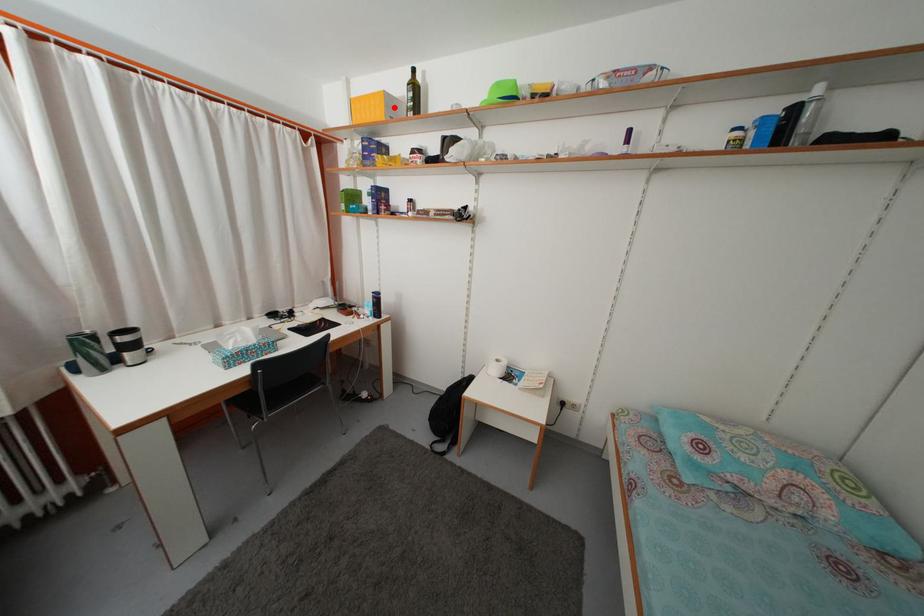
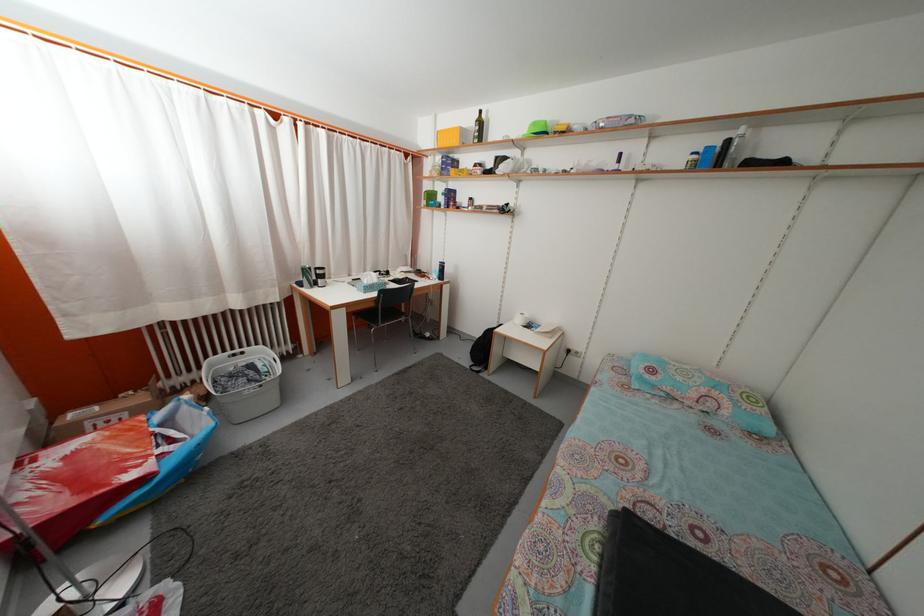
Where in the second image is the point corresponding to the highlighted location from the first image?

(468, 139)